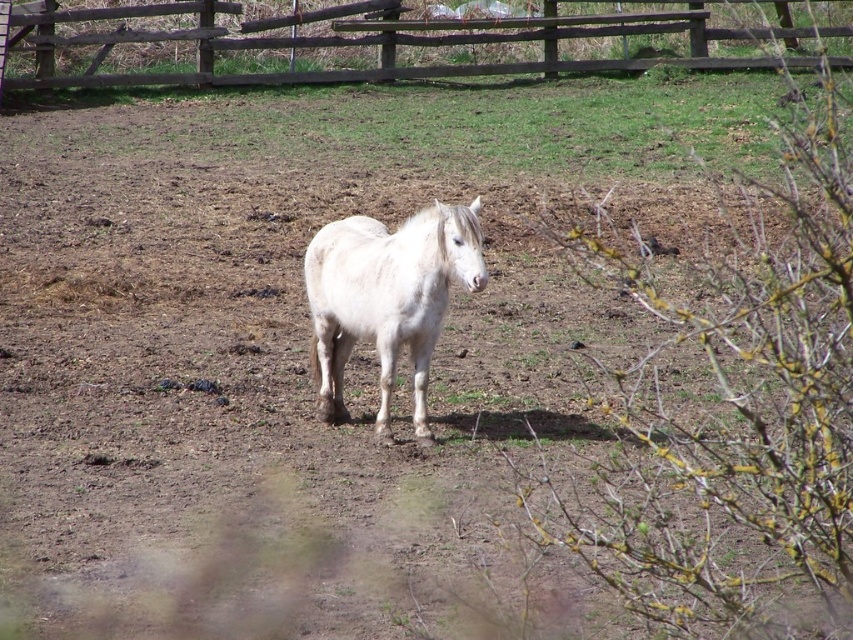
Question: Considering the relative positions of brown wooden fence at upper center and white matte horse at center in the image provided, where is brown wooden fence at upper center located with respect to white matte horse at center?

Choices:
 (A) above
 (B) below

Answer: (A)

Question: Is green grass at upper center positioned in front of brown wooden fence at upper center?

Choices:
 (A) no
 (B) yes

Answer: (B)

Question: Is green grass at upper center below brown wooden fence at upper center?

Choices:
 (A) no
 (B) yes

Answer: (B)

Question: Considering the real-world distances, which object is farthest from the green grass at upper center?

Choices:
 (A) brown wooden fence at upper center
 (B) white matte horse at center

Answer: (B)

Question: Considering the real-world distances, which object is farthest from the green grass at upper center?

Choices:
 (A) white matte horse at center
 (B) brown wooden fence at upper center

Answer: (A)

Question: Among these points, which one is nearest to the camera?

Choices:
 (A) click(x=120, y=148)
 (B) click(x=397, y=248)
 (C) click(x=213, y=3)

Answer: (B)